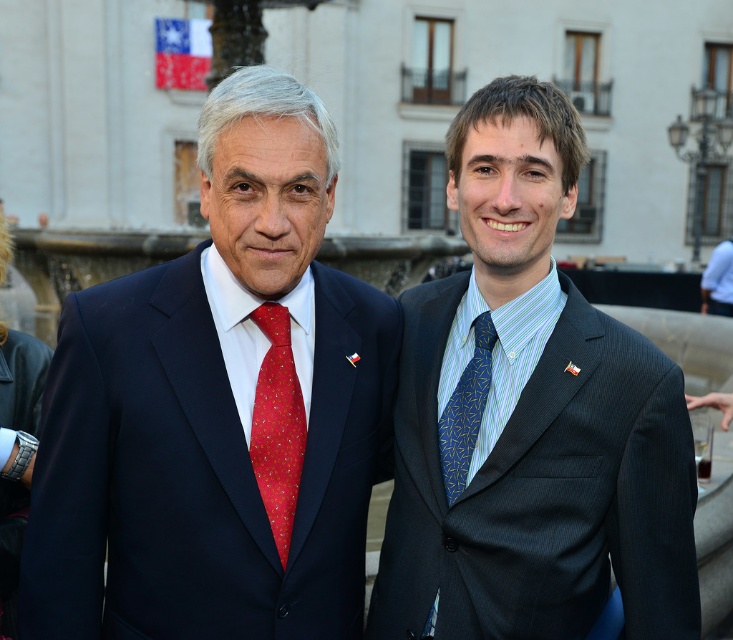
Is blue pinstripe suit at right positioned in front of blue silk tie at right?

Yes, blue pinstripe suit at right is in front of blue silk tie at right.

Between blue pinstripe suit at right and blue silk tie at right, which one appears on the left side from the viewer's perspective?

Positioned to the left is blue silk tie at right.

I want to click on blue pinstripe suit at right, so click(528, 417).

Where is `blue pinstripe suit at right`? This screenshot has width=733, height=640. blue pinstripe suit at right is located at coordinates (528, 417).

In the scene shown: Measure the distance from matte black suit at left to red silk tie at center.

matte black suit at left and red silk tie at center are 4.17 feet apart.

The height and width of the screenshot is (640, 733). What do you see at coordinates (218, 410) in the screenshot?
I see `matte black suit at left` at bounding box center [218, 410].

Between point (84, 372) and point (270, 412), which one is positioned behind?

Point (270, 412)

Where is `matte black suit at left`? This screenshot has height=640, width=733. matte black suit at left is located at coordinates (218, 410).

Does blue pinstripe suit at right appear over blue textured tie at right?

Incorrect, blue pinstripe suit at right is not positioned above blue textured tie at right.

Who is more distant from viewer, (x=490, y=140) or (x=446, y=483)?

Positioned behind is point (x=490, y=140).

What do you see at coordinates (528, 417) in the screenshot? I see `blue pinstripe suit at right` at bounding box center [528, 417].

What are the coordinates of `blue pinstripe suit at right` in the screenshot? It's located at (528, 417).